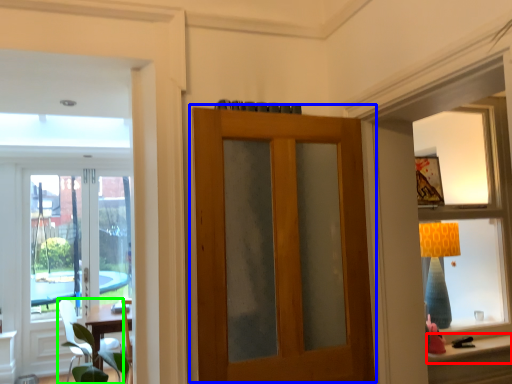
Question: Which object is the closest to the window sill (highlighted by a red box)? Choose among these: door (highlighted by a blue box) or chair (highlighted by a green box).

Choices:
 (A) door
 (B) chair

Answer: (A)